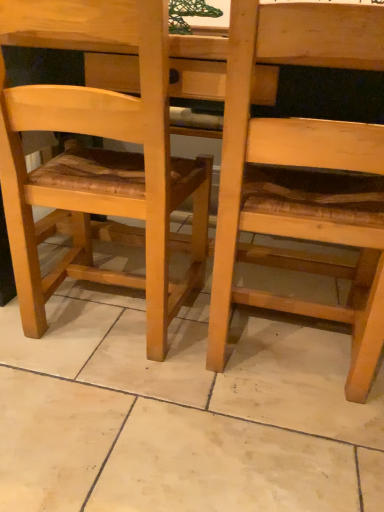
I want to click on natural wood chair at center, so click(x=99, y=162).

This screenshot has height=512, width=384. What do you see at coordinates (99, 162) in the screenshot?
I see `natural wood chair at center` at bounding box center [99, 162].

Where is `natural wood chair at center`? The width and height of the screenshot is (384, 512). natural wood chair at center is located at coordinates (99, 162).